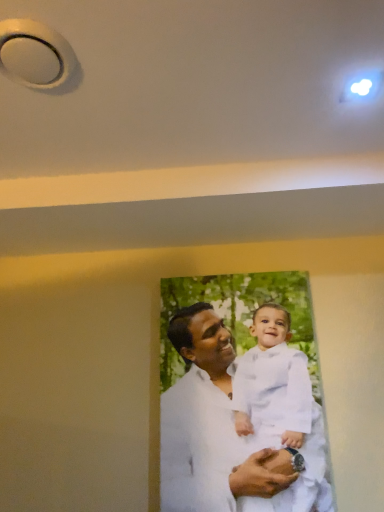
The width and height of the screenshot is (384, 512). Describe the element at coordinates (282, 404) in the screenshot. I see `white cotton baby at center` at that location.

In order to click on white cotton baby at center in this screenshot , I will do `click(282, 404)`.

Image resolution: width=384 pixels, height=512 pixels. Find the location of `white cotton baby at center`. white cotton baby at center is located at coordinates (282, 404).